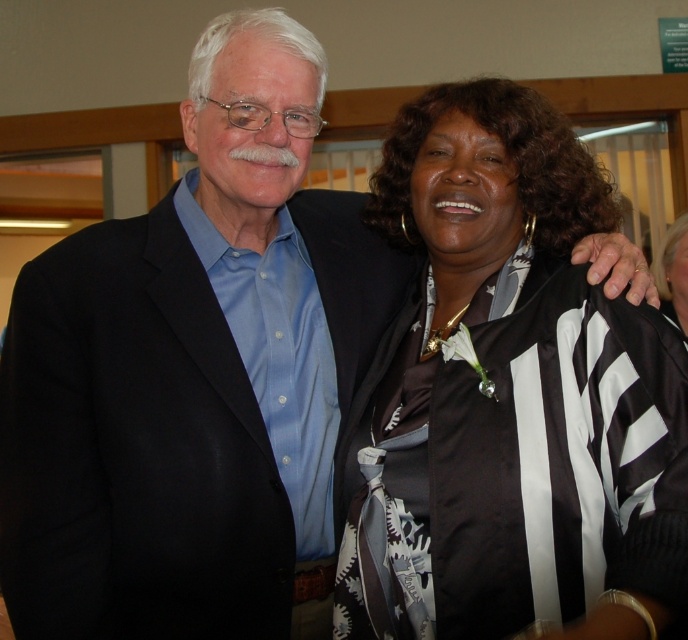
Question: Which point is farther to the camera?

Choices:
 (A) (228, 294)
 (B) (647, 563)

Answer: (A)

Question: Which object appears closest to the camera in this image?

Choices:
 (A) black satin suit at left
 (B) black satin jacket at upper right

Answer: (B)

Question: Is black satin suit at left to the left of black satin jacket at upper right from the viewer's perspective?

Choices:
 (A) yes
 (B) no

Answer: (A)

Question: Is black satin suit at left to the left of black satin jacket at upper right from the viewer's perspective?

Choices:
 (A) yes
 (B) no

Answer: (A)

Question: Which object appears farthest from the camera in this image?

Choices:
 (A) black satin suit at left
 (B) black satin jacket at upper right

Answer: (A)

Question: Does black satin suit at left have a smaller size compared to black satin jacket at upper right?

Choices:
 (A) yes
 (B) no

Answer: (B)